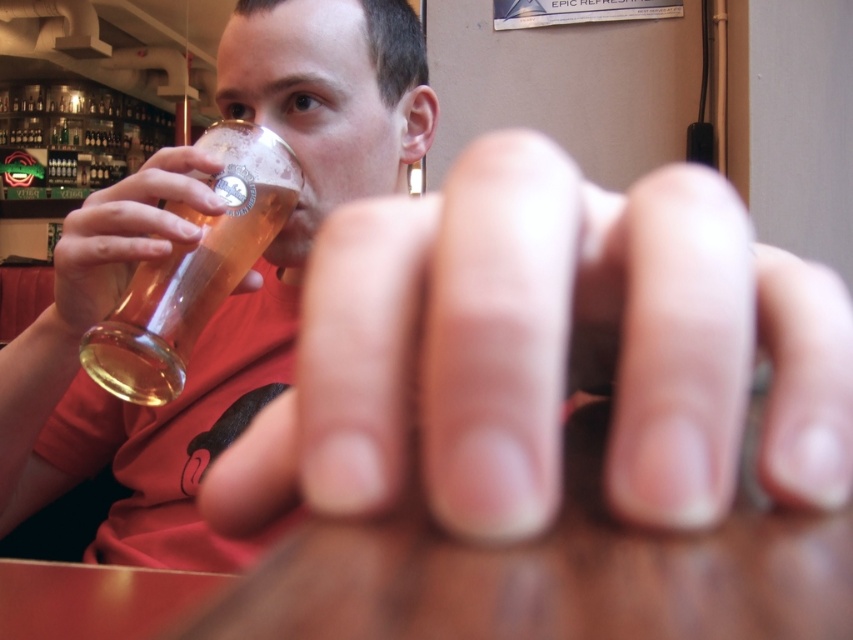
Is point (288, 212) positioned in front of point (64, 276)?

No, it is behind (64, 276).

Can you confirm if translucent glass mug at left is bigger than translucent glass beer at upper left?

Yes, translucent glass mug at left is bigger than translucent glass beer at upper left.

The image size is (853, 640). What do you see at coordinates (194, 268) in the screenshot?
I see `translucent glass mug at left` at bounding box center [194, 268].

You are a GUI agent. You are given a task and a screenshot of the screen. Output one action in this format:
    pyautogui.click(x=<x>, y=<y>)
    Task: Click on the translucent glass mug at left
    The image size is (853, 640).
    Given the screenshot: What is the action you would take?
    pyautogui.click(x=194, y=268)